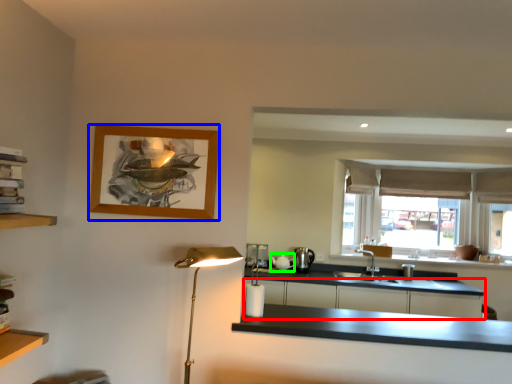
Question: Estimate the real-world distances between objects in this image. Which object is closer to cabinetry (highlighted by a red box), picture frame (highlighted by a blue box) or appliance (highlighted by a green box)?

Choices:
 (A) picture frame
 (B) appliance

Answer: (B)